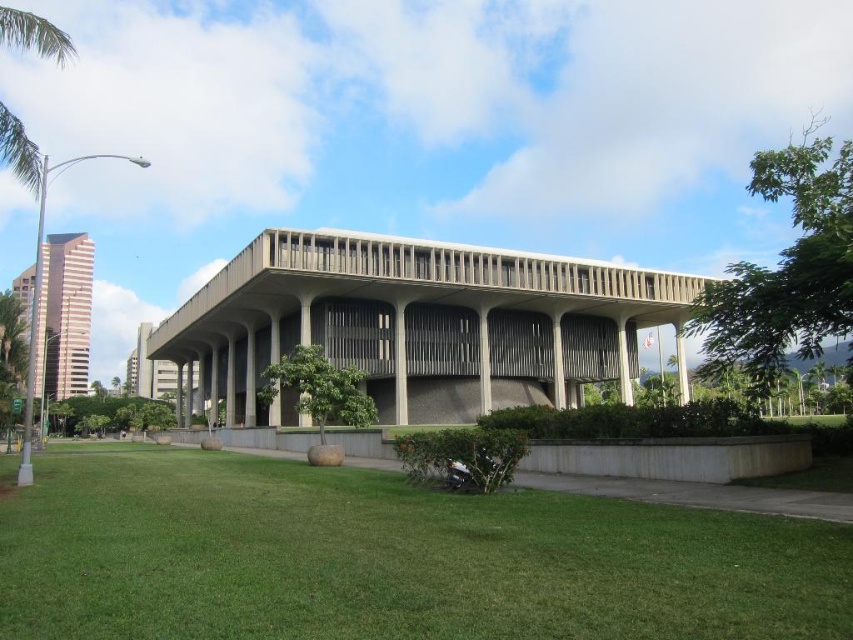
Question: Can you confirm if green grass at center is positioned to the left of green leafy palm tree at upper left?

Choices:
 (A) no
 (B) yes

Answer: (A)

Question: Which point is closer to the camera?

Choices:
 (A) (461, 627)
 (B) (18, 20)

Answer: (A)

Question: Can you confirm if green grass at center is wider than green leafy palm tree at upper left?

Choices:
 (A) no
 (B) yes

Answer: (A)

Question: Which point is farther to the camera?

Choices:
 (A) green leafy palm tree at upper left
 (B) green grass at center

Answer: (A)

Question: Is green grass at center in front of green leafy palm tree at upper left?

Choices:
 (A) no
 (B) yes

Answer: (B)

Question: Which point appears farthest from the camera in this image?

Choices:
 (A) (479, 532)
 (B) (62, 49)

Answer: (B)